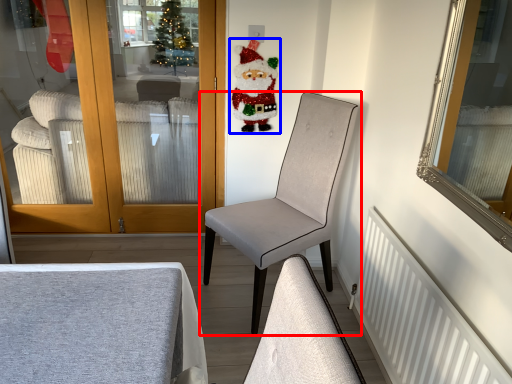
Question: Among these objects, which one is nearest to the camera, chair (highlighted by a red box) or santa claus (highlighted by a blue box)?

Choices:
 (A) chair
 (B) santa claus

Answer: (A)